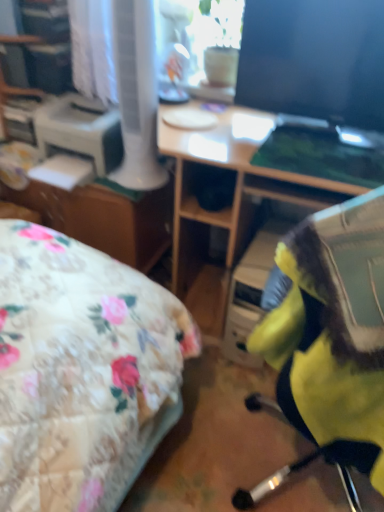
Find the location of `free location above wooden desk at center (from a real-world perspective)`. free location above wooden desk at center (from a real-world perspective) is located at coordinates (269, 133).